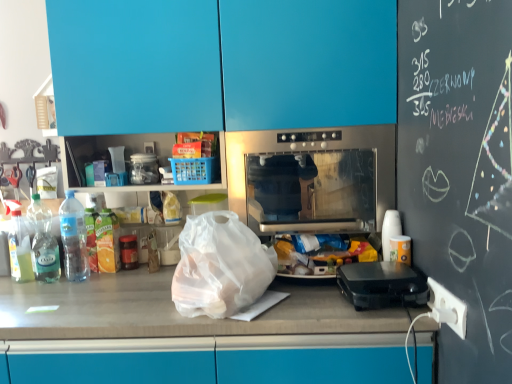
Question: In terms of size, does stainless steel oven at center appear bigger or smaller than clear plastic bottle at left, the first bottle in the left-to-right sequence?

Choices:
 (A) small
 (B) big

Answer: (B)

Question: From a real-world perspective, relative to clear plastic bottle at left, the first bottle in the left-to-right sequence, is stainless steel oven at center vertically above or below?

Choices:
 (A) below
 (B) above

Answer: (B)

Question: Which of these objects is positioned farthest from the clear plastic bottle at left, acting as the 3th bottle starting from the right?

Choices:
 (A) clear plastic bottle at left, acting as the 2th bottle starting from the left
 (B) blue glossy cabinets at upper center
 (C) black plastic waffle maker at right
 (D) translucent plastic bottle at left, which ranks as the first bottle in right-to-left order
 (E) stainless steel oven at center

Answer: (C)

Question: Which object is the closest to the clear plastic bottle at left, the first bottle in the left-to-right sequence?

Choices:
 (A) clear plastic bottle at left, the 2th bottle when ordered from right to left
 (B) translucent plastic bag at center
 (C) translucent plastic bottle at left, which ranks as the first bottle in right-to-left order
 (D) black plastic waffle maker at right
 (E) stainless steel oven at center

Answer: (A)